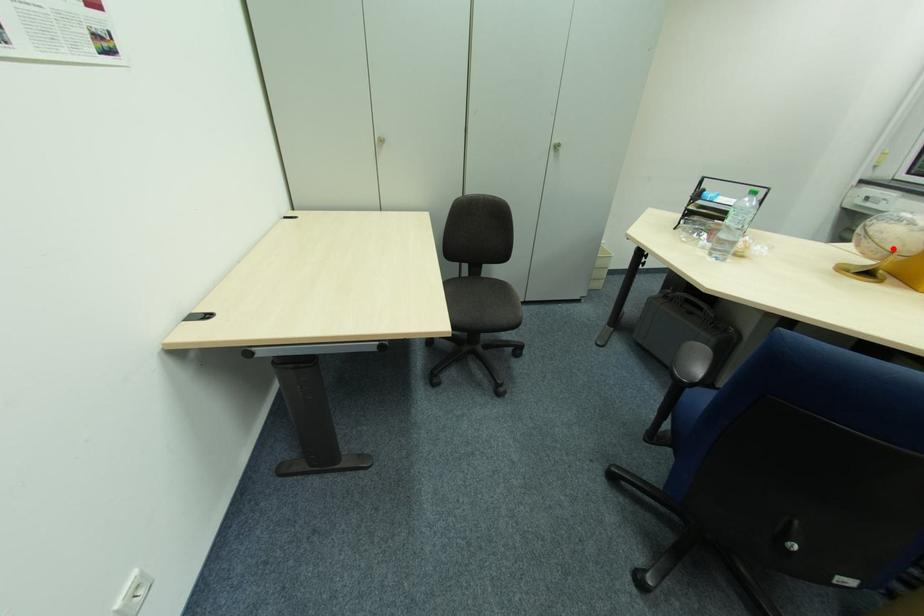
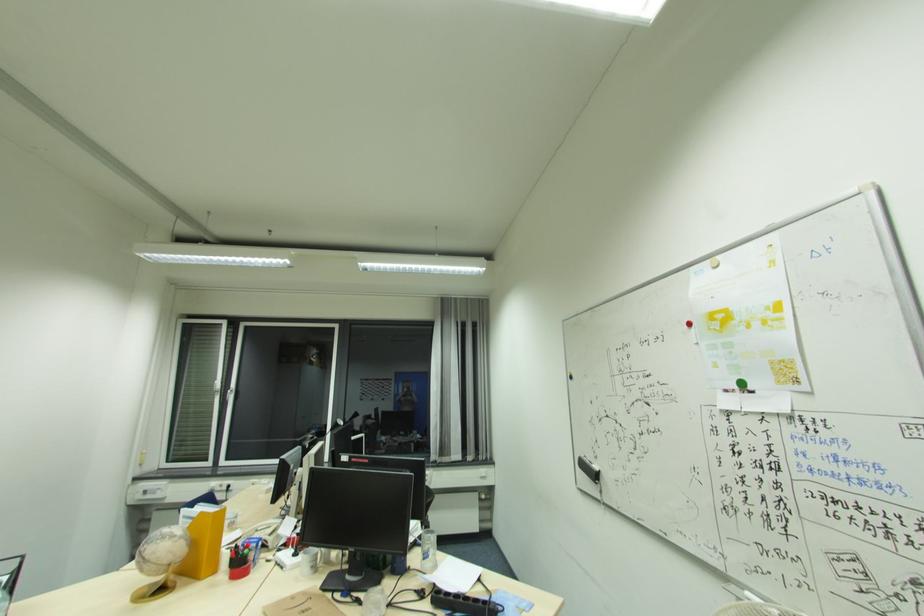
The point at the highlighted location is marked in the first image. Where is the corresponding point in the second image?

(167, 564)